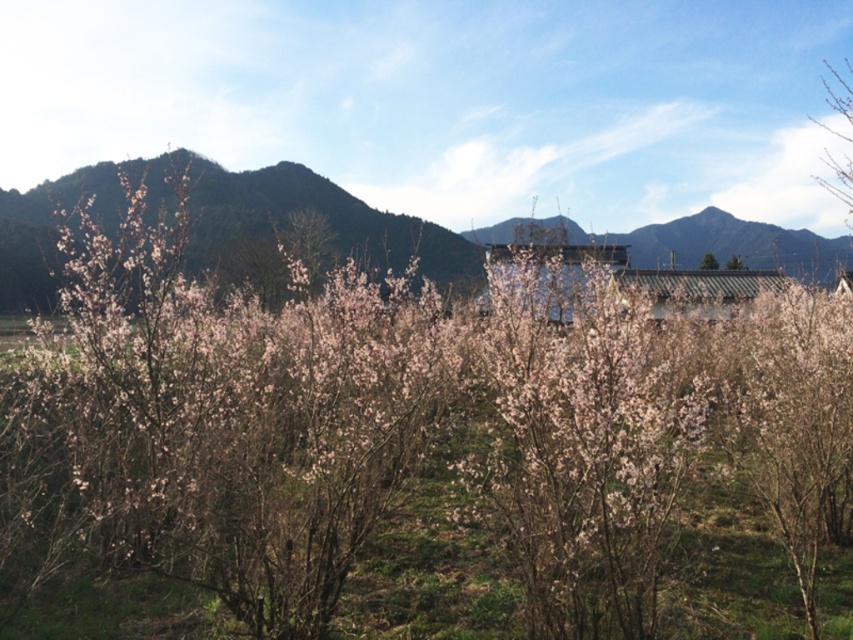
Can you confirm if green matte mountain at upper left is bigger than pink blossoms at center?

Correct, green matte mountain at upper left is larger in size than pink blossoms at center.

Who is positioned more to the left, green matte mountain at upper left or pink blossoms at center?

pink blossoms at center

Identify the location of green matte mountain at upper left. This screenshot has width=853, height=640. (225, 225).

Does green matte mountain at upper left appear on the right side of pink matte tree at center?

No, green matte mountain at upper left is not to the right of pink matte tree at center.

Where is `green matte mountain at upper left`? This screenshot has width=853, height=640. green matte mountain at upper left is located at coordinates pos(225,225).

Does pink blossoms at center appear over pink matte tree at center?

Actually, pink blossoms at center is below pink matte tree at center.

Measure the distance from pink blossoms at center to pink matte tree at center.

28.86 meters

Who is more forward, (331, 248) or (708, 256)?

Point (331, 248) is more forward.

Locate an element on the screen. Image resolution: width=853 pixels, height=640 pixels. pink blossoms at center is located at coordinates (306, 248).